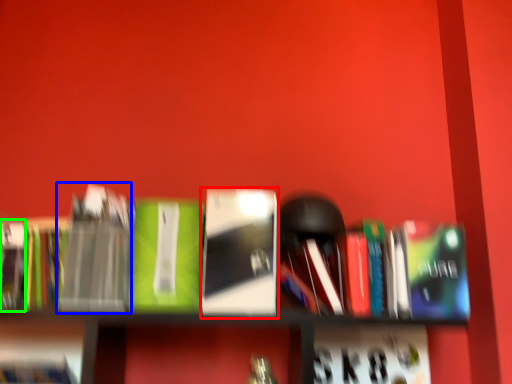
Question: Estimate the real-world distances between objects in this image. Which object is farther from book (highlighted by a red box), paperback book (highlighted by a blue box) or paperback book (highlighted by a green box)?

Choices:
 (A) paperback book
 (B) paperback book

Answer: (B)